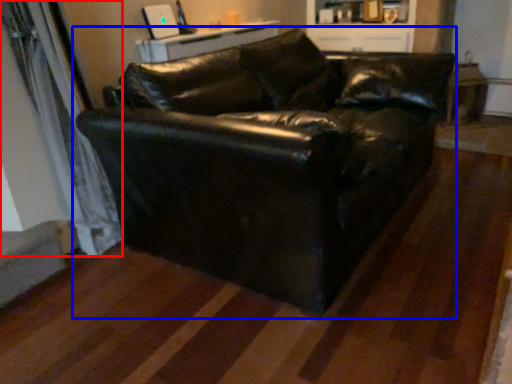
Question: Among these objects, which one is farthest to the camera, curtain (highlighted by a red box) or studio couch (highlighted by a blue box)?

Choices:
 (A) curtain
 (B) studio couch

Answer: (A)